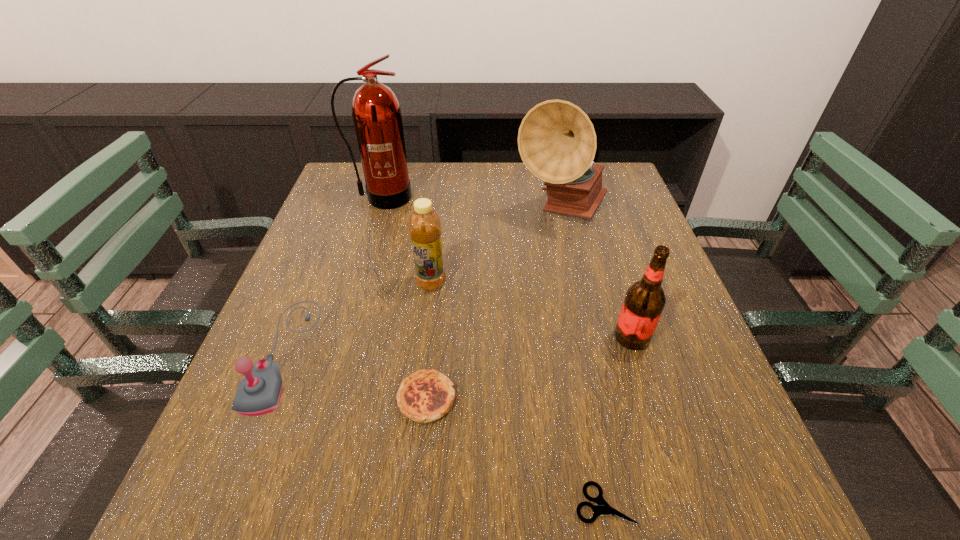
Locate an element on the screen. fire extinguisher is located at coordinates (376, 112).

Where is `the second tallest object`? the second tallest object is located at coordinates (557, 142).

Locate an element on the screen. root beer is located at coordinates (644, 301).

Where is `the fifth nearest object`? This screenshot has width=960, height=540. the fifth nearest object is located at coordinates (425, 230).

You are a GUI agent. You are given a task and a screenshot of the screen. Output one action in this format:
    pyautogui.click(x=<x>, y=<y>)
    Task: Click on the joystick
    
    Given the screenshot: What is the action you would take?
    pyautogui.click(x=259, y=392)

This screenshot has height=540, width=960. I want to click on quiche, so click(425, 396).

I want to click on the nearest object, so click(602, 508).

The height and width of the screenshot is (540, 960). I want to click on the shortest object, so click(602, 508).

Find the location of a particular element. free space located on the front-facing side of the fire extinguisher is located at coordinates (371, 235).

The width and height of the screenshot is (960, 540). I want to click on free space located on the horn of the second tallest object, so 600,377.